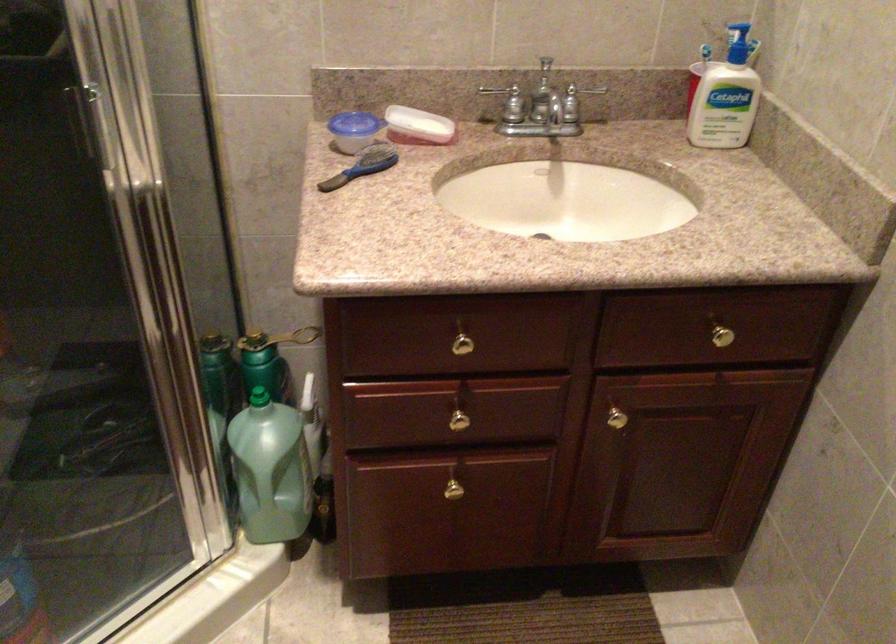
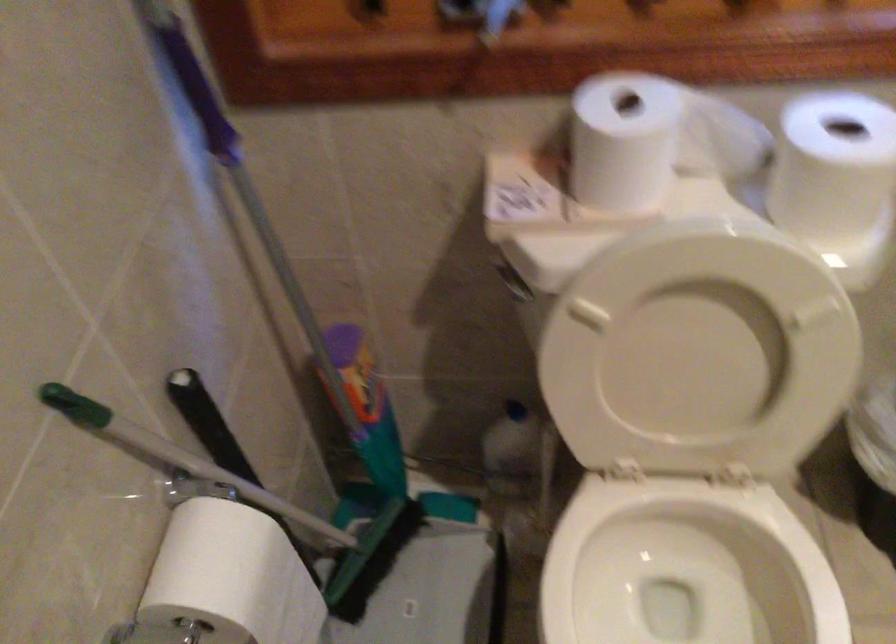
Based on the continuous images, in which direction is the camera rotating?

The camera rotated toward left-down.